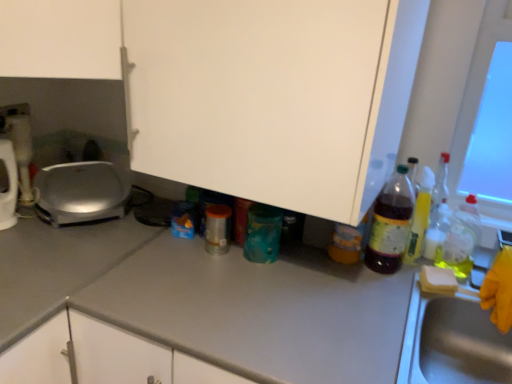
Identify the location of free location to the left of translucent plastic bottle at right, which is the 3th bottle from left to right. This screenshot has width=512, height=384. (321, 267).